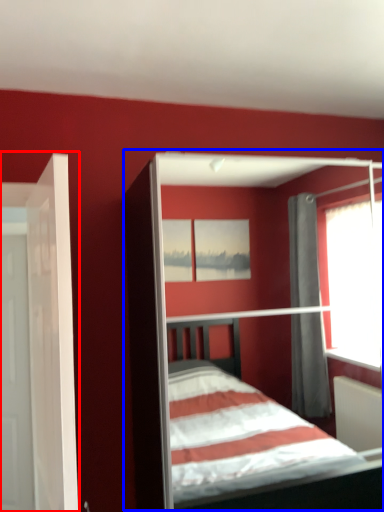
Question: Which object is closer to the camera taking this photo, door (highlighted by a red box) or bed (highlighted by a blue box)?

Choices:
 (A) door
 (B) bed

Answer: (A)